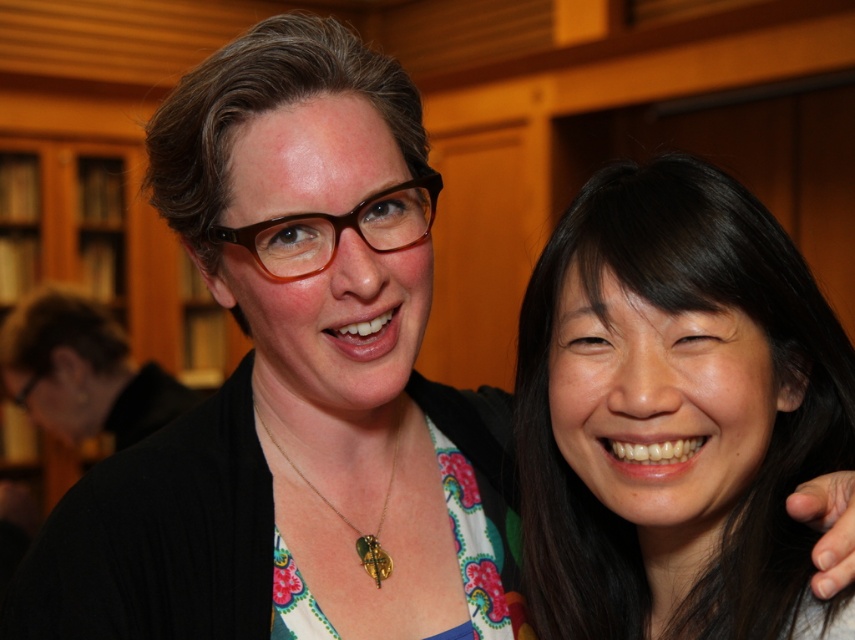
Question: Among these points, which one is farthest from the camera?

Choices:
 (A) (399, 417)
 (B) (812, 412)

Answer: (A)

Question: Which point is closer to the camera taking this photo?

Choices:
 (A) (298, 474)
 (B) (540, 365)

Answer: (B)

Question: Does black hair at right appear under gold metallic pendant at center?

Choices:
 (A) no
 (B) yes

Answer: (A)

Question: Does black hair at right have a smaller size compared to gold metallic pendant at center?

Choices:
 (A) no
 (B) yes

Answer: (A)

Question: Is black hair at right positioned at the back of gold metallic pendant at center?

Choices:
 (A) yes
 (B) no

Answer: (B)